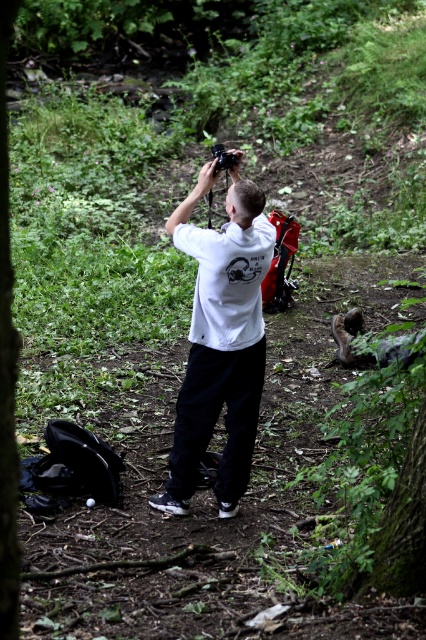
You are a photographer trying to capture a clear shot of the green leafy tree at center. However, the white matte hoodie at center is blocking your view. Can you adjust your position to see the entire tree without the hoodie obstructing it?

The white matte hoodie at center is below the green leafy tree at center, so moving your camera angle upwards would allow you to see the entire tree without obstruction from the hoodie.

You are a photographer trying to capture a closeup of the white matte hoodie at center and the green leafy tree at center in the same frame. Based on their sizes, which object should you focus on first to ensure both are in focus?

Since the white matte hoodie at center is narrower than the green leafy tree at center, you should focus on the green leafy tree at center first to ensure both are in focus.